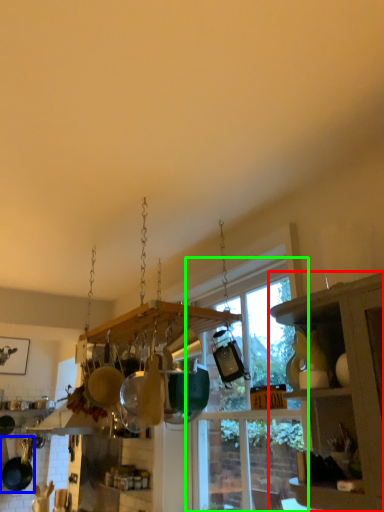
Question: Which object is the farthest from cabinetry (highlighted by a red box)? Choose among these: frying pan (highlighted by a blue box) or window (highlighted by a green box).

Choices:
 (A) frying pan
 (B) window

Answer: (A)